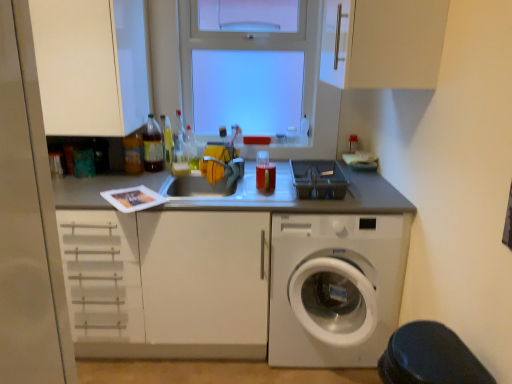
Question: Which direction should I rotate to look at translucent plastic bottle at center, which is counted as the fourth bottle, starting from the right?

Choices:
 (A) left
 (B) right

Answer: (A)

Question: Is black rubber step stool at lower right to the right of white matte cabinet at upper center, which is counted as the first cabinetry, starting from the right, from the viewer's perspective?

Choices:
 (A) yes
 (B) no

Answer: (A)

Question: Does black rubber step stool at lower right have a greater height compared to white matte cabinet at upper center, which appears as the 3th cabinetry when viewed from the left?

Choices:
 (A) no
 (B) yes

Answer: (A)

Question: Is the depth of black rubber step stool at lower right greater than that of white matte cabinet at upper center, which is counted as the first cabinetry, starting from the right?

Choices:
 (A) yes
 (B) no

Answer: (B)

Question: From a real-world perspective, does black rubber step stool at lower right stand above white matte cabinet at upper center, which appears as the 3th cabinetry when viewed from the left?

Choices:
 (A) no
 (B) yes

Answer: (A)

Question: Is the position of black rubber step stool at lower right less distant than that of white matte cabinet at upper center, which is counted as the first cabinetry, starting from the right?

Choices:
 (A) no
 (B) yes

Answer: (B)

Question: Can we say black rubber step stool at lower right lies outside white matte cabinet at upper center, which is counted as the first cabinetry, starting from the right?

Choices:
 (A) no
 (B) yes

Answer: (B)

Question: Considering the relative positions of translucent plastic bottle at upper left, the 5th bottle in the right-to-left sequence, and white matte cabinet at upper center, which appears as the 3th cabinetry when viewed from the left, in the image provided, is translucent plastic bottle at upper left, the 5th bottle in the right-to-left sequence, to the right of white matte cabinet at upper center, which appears as the 3th cabinetry when viewed from the left, from the viewer's perspective?

Choices:
 (A) no
 (B) yes

Answer: (A)

Question: From the image's perspective, would you say translucent plastic bottle at upper left, arranged as the 2th bottle when viewed from the left, is positioned over white matte cabinet at upper center, which is counted as the first cabinetry, starting from the right?

Choices:
 (A) no
 (B) yes

Answer: (A)

Question: Is translucent plastic bottle at upper left, arranged as the 2th bottle when viewed from the left, positioned behind white matte cabinet at upper center, which appears as the 3th cabinetry when viewed from the left?

Choices:
 (A) no
 (B) yes

Answer: (B)

Question: Does translucent plastic bottle at upper left, the 5th bottle in the right-to-left sequence, have a greater height compared to white matte cabinet at upper center, which appears as the 3th cabinetry when viewed from the left?

Choices:
 (A) yes
 (B) no

Answer: (B)

Question: From a real-world perspective, is translucent plastic bottle at upper left, arranged as the 2th bottle when viewed from the left, under white matte cabinet at upper center, which appears as the 3th cabinetry when viewed from the left?

Choices:
 (A) no
 (B) yes

Answer: (B)

Question: From the image's perspective, is translucent plastic bottle at upper left, arranged as the 2th bottle when viewed from the left, below white matte cabinet at upper center, which is counted as the first cabinetry, starting from the right?

Choices:
 (A) yes
 (B) no

Answer: (A)

Question: Is white plastic washing machine at lower right positioned with its back to black rubber step stool at lower right?

Choices:
 (A) yes
 (B) no

Answer: (B)